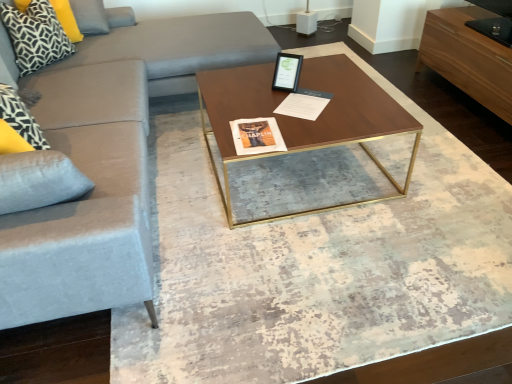
Question: In terms of width, does velvet light gray couch at left look wider or thinner when compared to light brown wood drawer at upper right?

Choices:
 (A) thin
 (B) wide

Answer: (B)

Question: From their relative heights in the image, would you say velvet light gray couch at left is taller or shorter than light brown wood drawer at upper right?

Choices:
 (A) short
 (B) tall

Answer: (B)

Question: Which is farther from the velvet light gray couch at left?

Choices:
 (A) black and white geometric pillow at upper left, the 2th pillow viewed from the front
 (B) patterned fabric pillow at upper left, which is the first pillow in front-to-back order
 (C) white paper at center
 (D) light brown wood drawer at upper right
 (E) walnut wood coffee table at center

Answer: (D)

Question: Which of these objects is positioned farthest from the patterned fabric pillow at upper left, which is the first pillow in front-to-back order?

Choices:
 (A) velvet light gray couch at left
 (B) light brown wood drawer at upper right
 (C) walnut wood coffee table at center
 (D) white paper at center
 (E) black and white geometric pillow at upper left, the 2th pillow viewed from the front

Answer: (B)